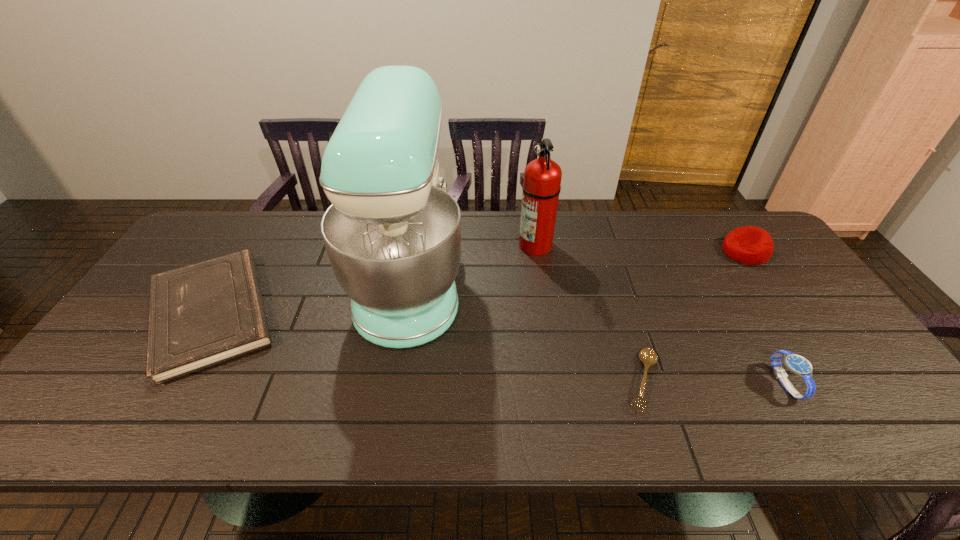
Where is `vacant position in the image that satisfies the following two spatial constraints: 1. on the back side of the ladle; 2. at the base of the fifth object from right to left`? The width and height of the screenshot is (960, 540). vacant position in the image that satisfies the following two spatial constraints: 1. on the back side of the ladle; 2. at the base of the fifth object from right to left is located at coordinates coord(612,280).

This screenshot has width=960, height=540. I want to click on free space that satisfies the following two spatial constraints: 1. at the nozzle of the fire extinguisher; 2. on the left side of the fifth object from left to right, so click(x=556, y=383).